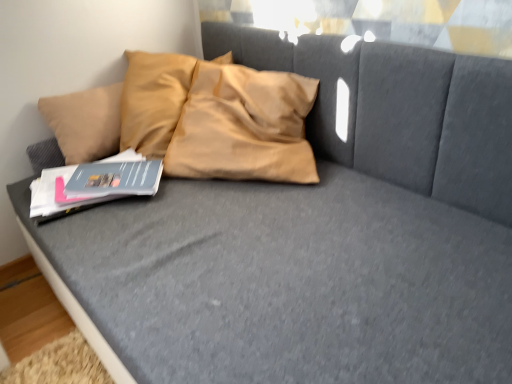
Find the location of a particular element. The image size is (512, 384). free point above matte blue paperback book at center-left, marked as the 1th paperback book in a back-to-front arrangement (from a real-world perspective) is located at coordinates (114, 167).